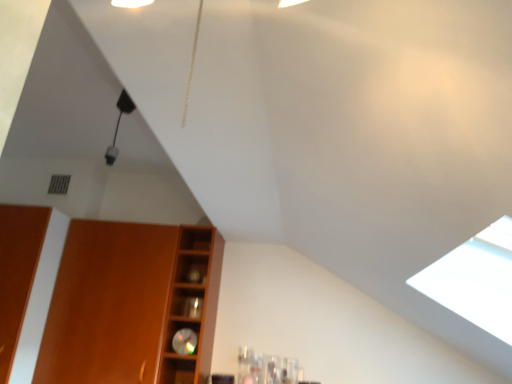
Identify the location of wooden shelf at center. The width and height of the screenshot is (512, 384). (192, 305).

The width and height of the screenshot is (512, 384). What do you see at coordinates (192, 305) in the screenshot?
I see `wooden shelf at center` at bounding box center [192, 305].

Describe the element at coordinates (130, 304) in the screenshot. I see `matte wood cabinet at left` at that location.

Locate an element on the screen. matte wood cabinet at left is located at coordinates (130, 304).

Measure the distance between matte wood cabinet at left and camera.

The depth of matte wood cabinet at left is 6.62 feet.

What is the approximate height of matte wood cabinet at left?

matte wood cabinet at left is 33.30 inches tall.

The width and height of the screenshot is (512, 384). What are the coordinates of `wooden shelf at center` in the screenshot? It's located at (192, 305).

Between wooden shelf at center and matte wood cabinet at left, which one appears on the right side from the viewer's perspective?

From the viewer's perspective, wooden shelf at center appears more on the right side.

Considering the positions of objects wooden shelf at center and matte wood cabinet at left in the image provided, who is behind, wooden shelf at center or matte wood cabinet at left?

wooden shelf at center is further away from the camera.

Does point (174, 271) appear closer or farther from the camera than point (91, 344)?

Point (174, 271) appears to be farther away from the viewer than point (91, 344).

From the image's perspective, between wooden shelf at center and matte wood cabinet at left, who is located below?

From the image's view, matte wood cabinet at left is below.

From a real-world perspective, which object stands above the other?

wooden shelf at center, from a real-world perspective.

In terms of width, does wooden shelf at center look wider or thinner when compared to matte wood cabinet at left?

Clearly, wooden shelf at center has less width compared to matte wood cabinet at left.

Who is taller, wooden shelf at center or matte wood cabinet at left?

matte wood cabinet at left.

Can you confirm if wooden shelf at center is smaller than matte wood cabinet at left?

Yes, wooden shelf at center is smaller than matte wood cabinet at left.

Is wooden shelf at center inside or outside of matte wood cabinet at left?

wooden shelf at center is outside matte wood cabinet at left.

Is there a large distance between wooden shelf at center and matte wood cabinet at left?

They are positioned close to each other.

Is wooden shelf at center oriented away from matte wood cabinet at left?

That's not correct — wooden shelf at center is not looking away from matte wood cabinet at left.

Can you tell me how much wooden shelf at center and matte wood cabinet at left differ in facing direction?

0.000476 degrees separate the facing orientations of wooden shelf at center and matte wood cabinet at left.

How distant is wooden shelf at center from matte wood cabinet at left?

5.72 inches.

The height and width of the screenshot is (384, 512). I want to click on cabinetry directly beneath the wooden shelf at center (from a real-world perspective), so click(130, 304).

Which is more to the left, matte wood cabinet at left or wooden shelf at center?

matte wood cabinet at left is more to the left.

Between matte wood cabinet at left and wooden shelf at center, which one is positioned behind?

Positioned behind is wooden shelf at center.

Does point (96, 378) appear closer or farther from the camera than point (199, 321)?

Point (96, 378) is positioned closer to the camera compared to point (199, 321).

From the image's perspective, is matte wood cabinet at left on top of wooden shelf at center?

Actually, matte wood cabinet at left appears below wooden shelf at center in the image.

From a real-world perspective, which is physically above, matte wood cabinet at left or wooden shelf at center?

In real-world perspective, wooden shelf at center is above.

Considering the relative sizes of matte wood cabinet at left and wooden shelf at center in the image provided, is matte wood cabinet at left wider than wooden shelf at center?

Correct, the width of matte wood cabinet at left exceeds that of wooden shelf at center.

Is matte wood cabinet at left taller or shorter than wooden shelf at center?

In the image, matte wood cabinet at left appears to be taller than wooden shelf at center.

Considering the sizes of objects matte wood cabinet at left and wooden shelf at center in the image provided, who is smaller, matte wood cabinet at left or wooden shelf at center?

Smaller between the two is wooden shelf at center.

Would you say matte wood cabinet at left is inside or outside wooden shelf at center?

matte wood cabinet at left cannot be found inside wooden shelf at center.

Is matte wood cabinet at left in contact with wooden shelf at center?

No.

Is matte wood cabinet at left turned away from wooden shelf at center?

matte wood cabinet at left is not turned away from wooden shelf at center.

At what (x,y) coordinates should I click in order to perform the action: click on shelf above the matte wood cabinet at left (from the image's perspective). Please return your answer as a coordinate pair (x, y). This screenshot has width=512, height=384. Looking at the image, I should click on (192, 305).

The image size is (512, 384). Find the location of `shelf to the right of matte wood cabinet at left`. shelf to the right of matte wood cabinet at left is located at coordinates (192, 305).

Find the location of `cabinetry in front of the wooden shelf at center`. cabinetry in front of the wooden shelf at center is located at coordinates 130,304.